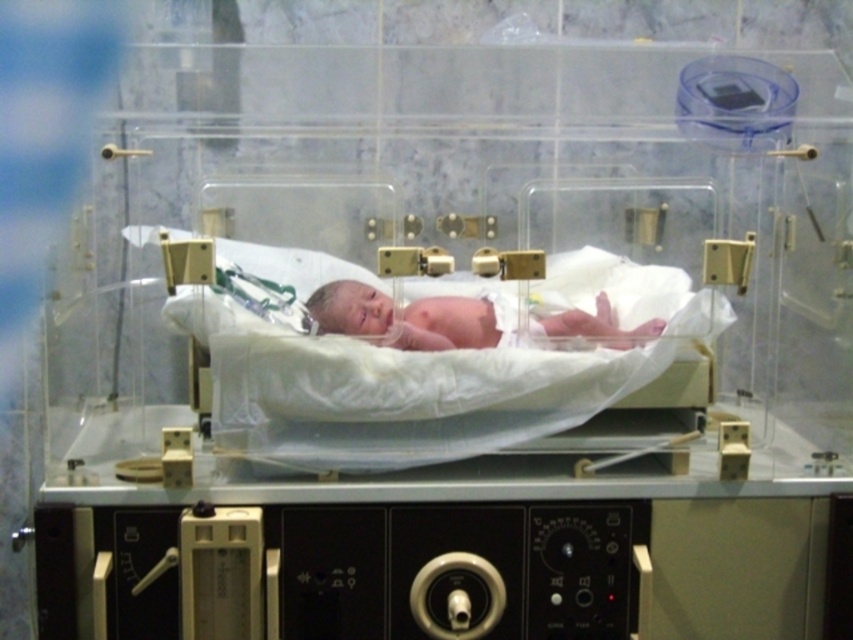
Question: Can you confirm if white fabric hospital bed at center is positioned to the right of pink smooth skin at center?

Choices:
 (A) yes
 (B) no

Answer: (B)

Question: Among these objects, which one is farthest from the camera?

Choices:
 (A) pink smooth skin at center
 (B) white fabric hospital bed at center

Answer: (A)

Question: Is white fabric hospital bed at center bigger than pink smooth skin at center?

Choices:
 (A) yes
 (B) no

Answer: (A)

Question: Is white fabric hospital bed at center closer to camera compared to pink smooth skin at center?

Choices:
 (A) no
 (B) yes

Answer: (B)

Question: Which point is farther to the camera?

Choices:
 (A) (566, 314)
 (B) (215, 362)

Answer: (A)